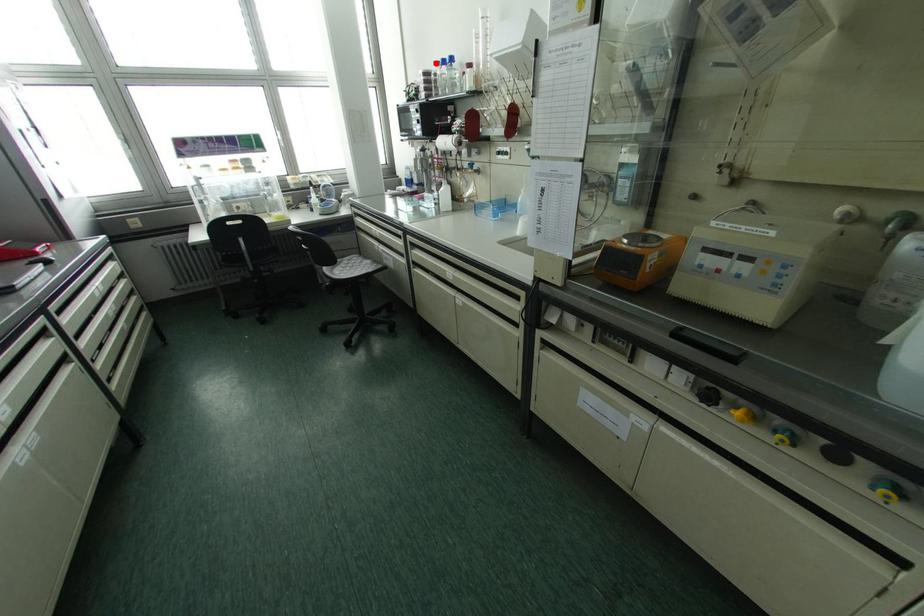
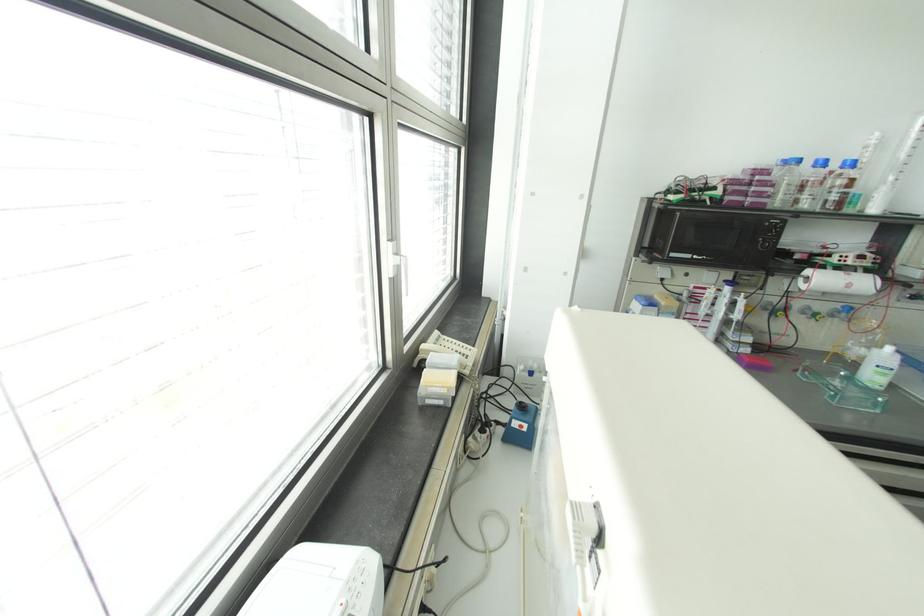
Locate, in the second image, the point that corresponds to the highlighted location in the first image.

(797, 160)